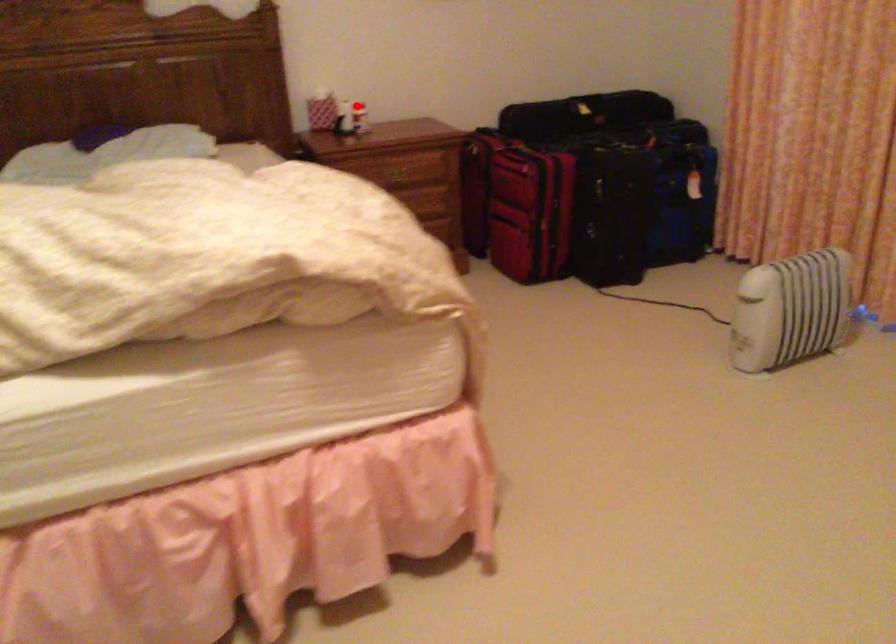
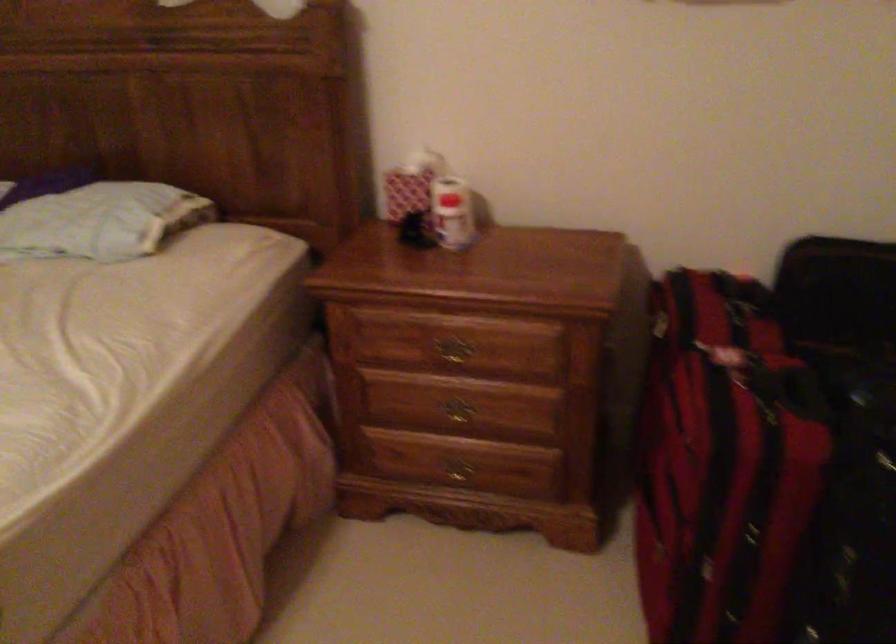
The point at the highlighted location is marked in the first image. Where is the corresponding point in the second image?

(452, 213)